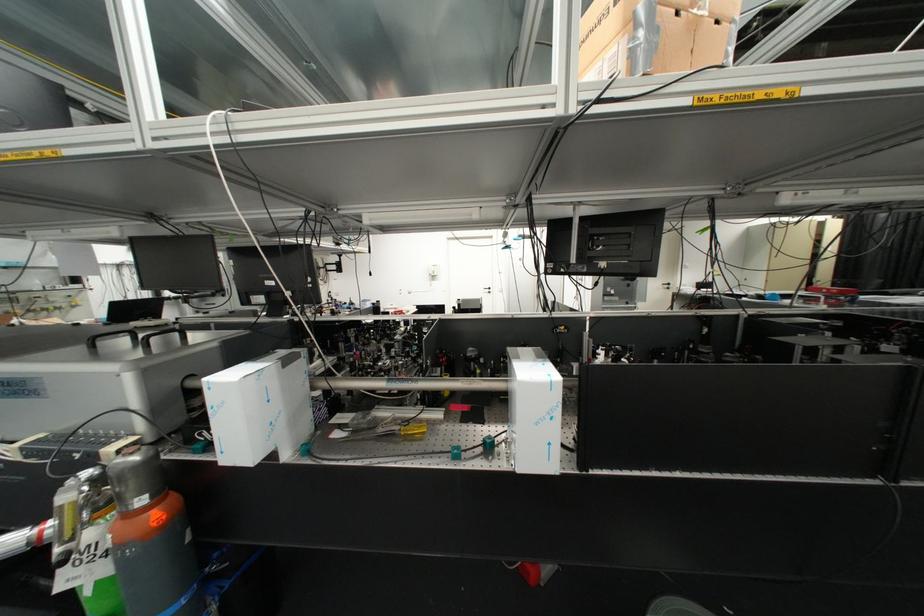
The image size is (924, 616). I want to click on red valve knob, so click(x=136, y=479).